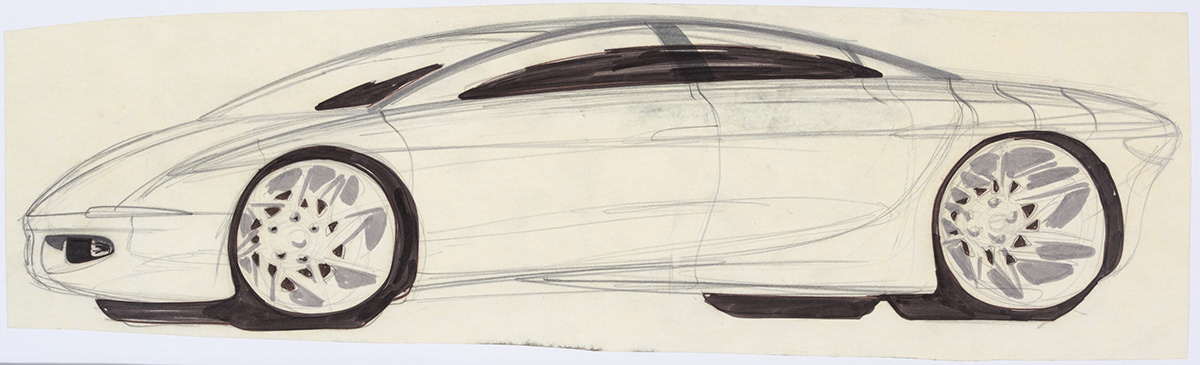
The height and width of the screenshot is (365, 1200). Identify the location of wall. (167, 49).